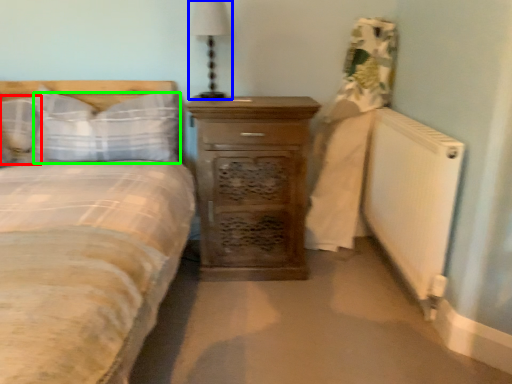
Question: Considering the real-world distances, which object is farthest from pillow (highlighted by a red box)? bedside lamp (highlighted by a blue box) or pillow (highlighted by a green box)?

Choices:
 (A) bedside lamp
 (B) pillow

Answer: (A)